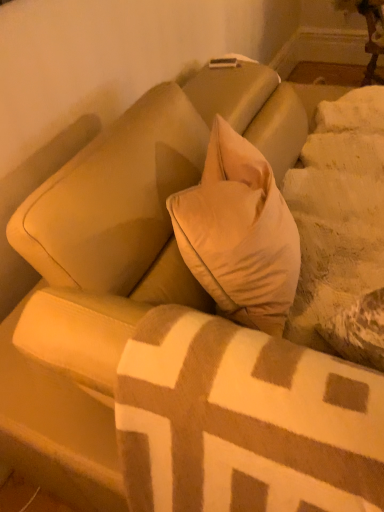
What do you see at coordinates (341, 230) in the screenshot?
I see `white textured sheet at upper right` at bounding box center [341, 230].

The height and width of the screenshot is (512, 384). I want to click on white textured sheet at upper right, so click(341, 230).

Where is `white textured sheet at upper right`? white textured sheet at upper right is located at coordinates (341, 230).